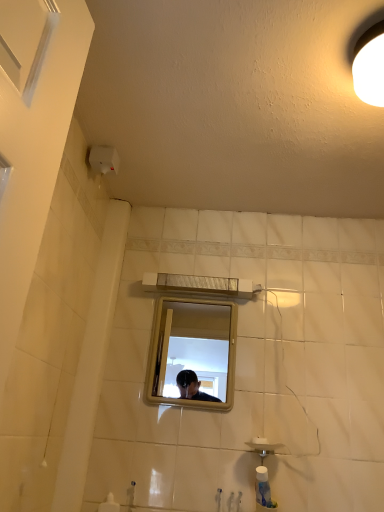
Question: From the image's perspective, does matte silver faucet at lower center appear lower than metallic rectangular mirror at center?

Choices:
 (A) yes
 (B) no

Answer: (A)

Question: Can we say matte silver faucet at lower center lies outside metallic rectangular mirror at center?

Choices:
 (A) no
 (B) yes

Answer: (B)

Question: From a real-world perspective, is matte silver faucet at lower center under metallic rectangular mirror at center?

Choices:
 (A) yes
 (B) no

Answer: (A)

Question: Is metallic rectangular mirror at center completely or partially inside matte silver faucet at lower center?

Choices:
 (A) no
 (B) yes

Answer: (A)

Question: Does matte silver faucet at lower center have a lesser height compared to metallic rectangular mirror at center?

Choices:
 (A) yes
 (B) no

Answer: (A)

Question: Are matte silver faucet at lower center and metallic rectangular mirror at center far apart?

Choices:
 (A) yes
 (B) no

Answer: (A)

Question: Is metallic rectangular mirror at center shorter than matte silver faucet at lower center?

Choices:
 (A) no
 (B) yes

Answer: (A)

Question: From a real-world perspective, is metallic rectangular mirror at center physically below matte silver faucet at lower center?

Choices:
 (A) no
 (B) yes

Answer: (A)

Question: Is metallic rectangular mirror at center at the left side of matte silver faucet at lower center?

Choices:
 (A) no
 (B) yes

Answer: (A)

Question: Is metallic rectangular mirror at center far away from matte silver faucet at lower center?

Choices:
 (A) yes
 (B) no

Answer: (A)

Question: Is metallic rectangular mirror at center not inside matte silver faucet at lower center?

Choices:
 (A) yes
 (B) no

Answer: (A)

Question: Could you tell me if metallic rectangular mirror at center is turned towards matte silver faucet at lower center?

Choices:
 (A) no
 (B) yes

Answer: (A)

Question: Is metallic rectangular mirror at center taller than white matte light fixture at upper right?

Choices:
 (A) yes
 (B) no

Answer: (A)